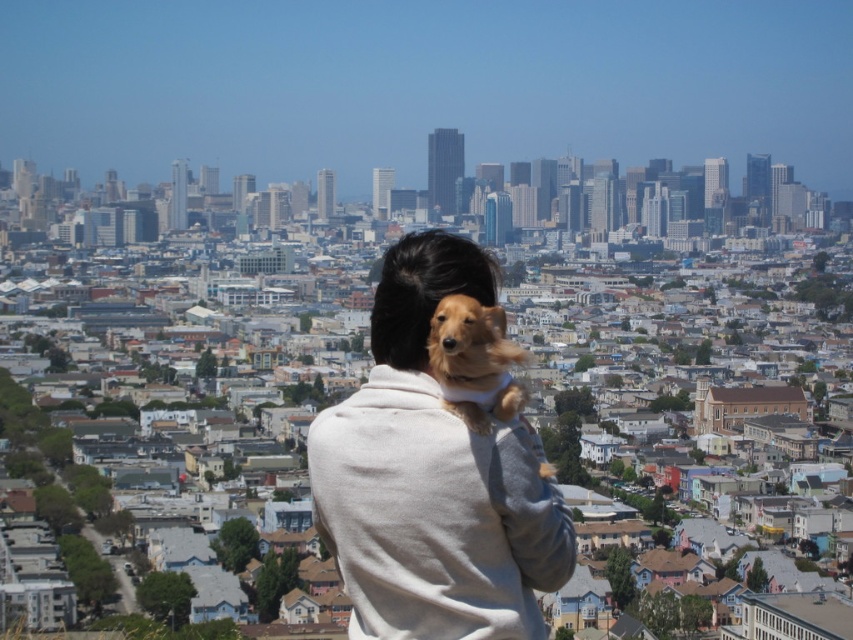
Question: Which point is farther from the camera taking this photo?

Choices:
 (A) (312, 518)
 (B) (432, 355)

Answer: (A)

Question: Which object is closer to the camera taking this photo?

Choices:
 (A) light beige sweater at center
 (B) golden fur dog at upper center

Answer: (A)

Question: Is light beige sweater at center positioned before golden fur dog at upper center?

Choices:
 (A) yes
 (B) no

Answer: (A)

Question: Which point is farther to the camera?

Choices:
 (A) (437, 282)
 (B) (521, 355)

Answer: (B)

Question: Does light beige sweater at center appear under golden fur dog at upper center?

Choices:
 (A) yes
 (B) no

Answer: (A)

Question: Can you confirm if light beige sweater at center is bigger than golden fur dog at upper center?

Choices:
 (A) yes
 (B) no

Answer: (A)